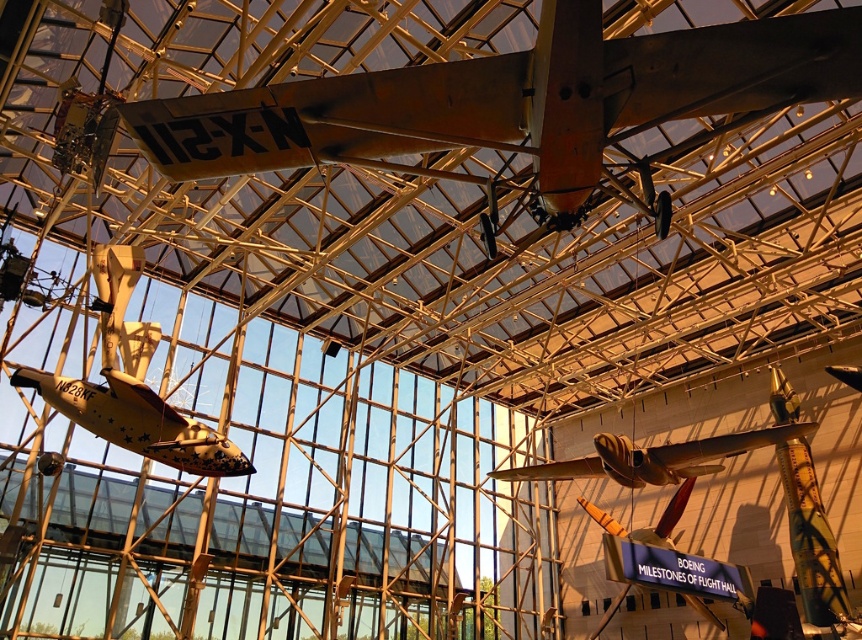
You are a visitor in the aviation museum and want to take a photo of both the rusty metal airplane at upper center and the shiny silver airplane at center. Which airplane should you stand closer to in order to capture both in a single frame without zooming?

You should stand closer to the rusty metal airplane at upper center because it is shorter than the shiny silver airplane at center, allowing both to fit within the camera frame more easily when positioned closer to the smaller object.

You are an aviation enthusiast visiting the Boeing Milestones of Flight Hall. You notice two aircraft in the hall. The first is a rusty metal airplane at upper center, and the second is a shiny silver airplane at center. Based on their sizes, which airplane do you think is smaller?

The rusty metal airplane at upper center is smaller than the shiny silver airplane at center because its width is less than the latter.